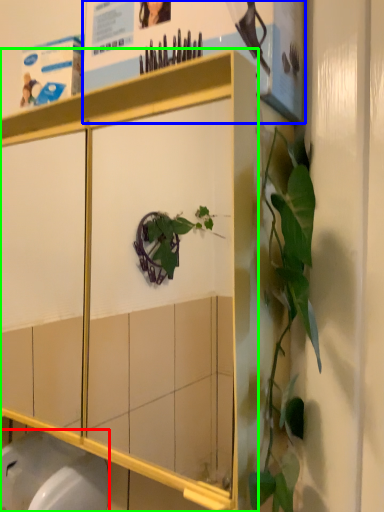
Question: Considering the real-world distances, which object is farthest from toilet bowl (highlighted by a red box)? poster page (highlighted by a blue box) or cabinetry (highlighted by a green box)?

Choices:
 (A) poster page
 (B) cabinetry

Answer: (A)